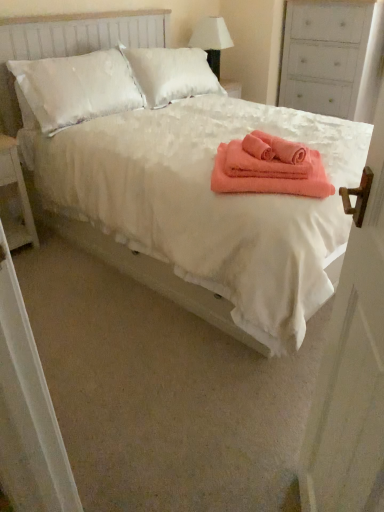
Question: From a real-world perspective, is coral soft towel at center physically located above or below white painted wood dresser at upper right?

Choices:
 (A) above
 (B) below

Answer: (B)

Question: Does point (266, 155) appear closer or farther from the camera than point (357, 60)?

Choices:
 (A) closer
 (B) farther

Answer: (A)

Question: Estimate the real-world distances between objects in this image. Which object is farther from the white wood nightstand at left?

Choices:
 (A) white wooden door at right
 (B) coral soft towel at center
 (C) white fabric lampshade at upper center
 (D) coral soft towel at center
 (E) white painted wood dresser at upper right

Answer: (E)

Question: Based on their relative distances, which object is farther from the white painted wood dresser at upper right?

Choices:
 (A) white fabric lampshade at upper center
 (B) coral plush bath towel at center
 (C) white wood nightstand at left
 (D) coral soft towel at center
 (E) white wooden door at right

Answer: (E)